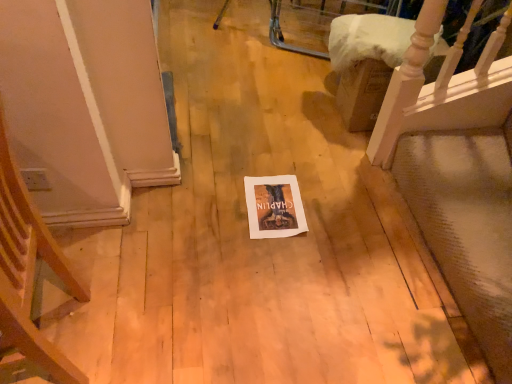
Locate an element on the screen. The width and height of the screenshot is (512, 384). wooden armchair at left is located at coordinates (30, 271).

Identify the location of white paper at center. The height and width of the screenshot is (384, 512). (274, 207).

The width and height of the screenshot is (512, 384). I want to click on wooden staircase at upper right, so click(x=365, y=63).

The image size is (512, 384). I want to click on armchair on the left side of white paper at center, so click(30, 271).

Is point (261, 182) positioned in front of point (53, 253)?

No, it is behind (53, 253).

Considering the sizes of objects white paper at center and wooden armchair at left in the image provided, who is smaller, white paper at center or wooden armchair at left?

Smaller between the two is white paper at center.

Based on the photo, are wooden staircase at upper right and white paper at center beside each other?

No, wooden staircase at upper right is not beside white paper at center.

Considering the sizes of wooden staircase at upper right and white paper at center in the image, is wooden staircase at upper right wider or thinner than white paper at center?

Clearly, wooden staircase at upper right has more width compared to white paper at center.

From a real-world perspective, which is physically above, wooden staircase at upper right or white paper at center?

wooden staircase at upper right.

Is wooden staircase at upper right inside the boundaries of wooden armchair at left, or outside?

wooden staircase at upper right cannot be found inside wooden armchair at left.

Does point (334, 20) lie behind point (52, 263)?

Yes, point (334, 20) is farther from viewer.

From the image's perspective, is wooden staircase at upper right located beneath wooden armchair at left?

Incorrect, from the image's perspective, wooden staircase at upper right is higher than wooden armchair at left.

In terms of size, does wooden staircase at upper right appear bigger or smaller than wooden armchair at left?

In the image, wooden staircase at upper right appears to be smaller than wooden armchair at left.

How far apart are wooden armchair at left and wooden staircase at upper right?

A distance of 4.28 feet exists between wooden armchair at left and wooden staircase at upper right.

Which is in front, wooden armchair at left or wooden staircase at upper right?

wooden armchair at left is in front.

Is wooden armchair at left inside or outside of wooden staircase at upper right?

wooden armchair at left is located beyond the bounds of wooden staircase at upper right.

Is point (50, 375) in front of point (366, 70)?

Yes, it is.

Does point (4, 231) lie behind point (286, 204)?

No.

Is wooden armchair at left not near white paper at center?

No, wooden armchair at left is not far from white paper at center.

Identify the location of postcard lying on the right of wooden armchair at left. (274, 207).

From the image's perspective, which one is positioned lower, white paper at center or wooden staircase at upper right?

white paper at center.

You are a GUI agent. You are given a task and a screenshot of the screen. Output one action in this format:
    pyautogui.click(x=<x>, y=<y>)
    Task: Click on the furniture that is behind the white paper at center
    
    Given the screenshot: What is the action you would take?
    pyautogui.click(x=365, y=63)

Consider the image. Is white paper at center shorter than wooden staircase at upper right?

Yes.

Between white paper at center and wooden staircase at upper right, which one appears on the left side from the viewer's perspective?

Positioned to the left is white paper at center.

At what (x,y) coordinates should I click in order to perform the action: click on armchair lying below the white paper at center (from the image's perspective). Please return your answer as a coordinate pair (x, y). Looking at the image, I should click on (30, 271).

The height and width of the screenshot is (384, 512). I want to click on furniture that is above the white paper at center (from the image's perspective), so click(365, 63).

Which object lies further to the anchor point wooden staircase at upper right, white paper at center or wooden armchair at left?

wooden armchair at left is further to wooden staircase at upper right.

Which object lies further to the anchor point wooden armchair at left, white paper at center or wooden staircase at upper right?

Based on the image, wooden staircase at upper right appears to be further to wooden armchair at left.

Based on their spatial positions, is wooden armchair at left or white paper at center closer to wooden staircase at upper right?

Based on the image, white paper at center appears to be nearer to wooden staircase at upper right.

Looking at the image, which one is located further to wooden armchair at left, wooden staircase at upper right or white paper at center?

The object further to wooden armchair at left is wooden staircase at upper right.

Looking at the image, which one is located closer to white paper at center, wooden armchair at left or wooden staircase at upper right?

Based on the image, wooden staircase at upper right appears to be nearer to white paper at center.

Considering their positions, is wooden staircase at upper right positioned closer to white paper at center than wooden armchair at left?

wooden staircase at upper right.

Where is `postcard between wooden armchair at left and wooden staircase at upper right in the front-back direction`? The height and width of the screenshot is (384, 512). postcard between wooden armchair at left and wooden staircase at upper right in the front-back direction is located at coordinates (274, 207).